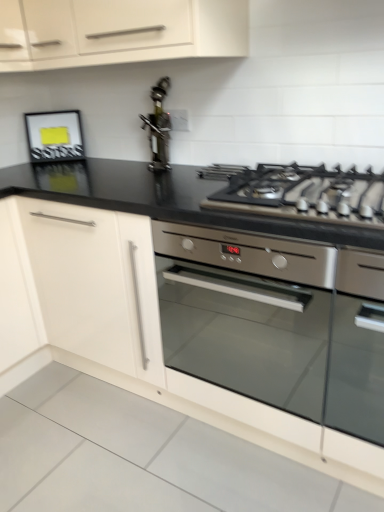
Question: Considering the relative positions of white matte cabinet at left, the 2th cabinetry positioned from the top, and satin silver gas stove at upper right in the image provided, is white matte cabinet at left, the 2th cabinetry positioned from the top, to the right of satin silver gas stove at upper right from the viewer's perspective?

Choices:
 (A) yes
 (B) no

Answer: (B)

Question: Is satin silver gas stove at upper right at the back of white matte cabinet at left, the first cabinetry positioned from the bottom?

Choices:
 (A) no
 (B) yes

Answer: (A)

Question: Would you say white matte cabinet at left, the 2th cabinetry positioned from the top, is outside satin silver gas stove at upper right?

Choices:
 (A) no
 (B) yes

Answer: (B)

Question: Are white matte cabinet at left, the first cabinetry positioned from the bottom, and satin silver gas stove at upper right located far from each other?

Choices:
 (A) yes
 (B) no

Answer: (B)

Question: Would you say white matte cabinet at left, the first cabinetry positioned from the bottom, contains satin silver gas stove at upper right?

Choices:
 (A) yes
 (B) no

Answer: (B)

Question: Considering the relative sizes of white matte cabinet at left, the first cabinetry positioned from the bottom, and satin silver gas stove at upper right in the image provided, is white matte cabinet at left, the first cabinetry positioned from the bottom, smaller than satin silver gas stove at upper right?

Choices:
 (A) yes
 (B) no

Answer: (B)

Question: Is white matte cabinet at left, the 2th cabinetry positioned from the top, outside matte black frame at upper left?

Choices:
 (A) yes
 (B) no

Answer: (A)

Question: Is white matte cabinet at left, the first cabinetry positioned from the bottom, wider than matte black frame at upper left?

Choices:
 (A) yes
 (B) no

Answer: (A)

Question: From a real-world perspective, does white matte cabinet at left, the first cabinetry positioned from the bottom, stand above matte black frame at upper left?

Choices:
 (A) no
 (B) yes

Answer: (A)

Question: Can you confirm if white matte cabinet at left, the first cabinetry positioned from the bottom, is positioned to the left of matte black frame at upper left?

Choices:
 (A) yes
 (B) no

Answer: (A)

Question: Could you tell me if white matte cabinet at left, the 2th cabinetry positioned from the top, is facing matte black frame at upper left?

Choices:
 (A) yes
 (B) no

Answer: (B)

Question: From a real-world perspective, is white matte cabinet at upper left, placed as the 2th cabinetry when sorted from bottom to top, below stainless steel oil dispenser at center?

Choices:
 (A) no
 (B) yes

Answer: (A)